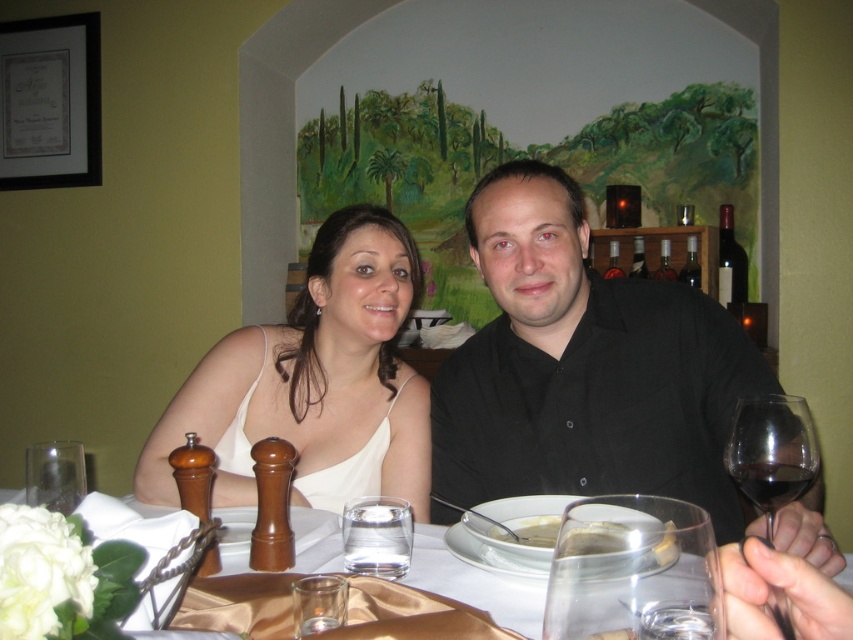
Question: Among these objects, which one is farthest from the camera?

Choices:
 (A) translucent glass water at center
 (B) white creamy soup at center
 (C) transparent glass wine glass at lower right
 (D) transparent glass wine glass at right

Answer: (B)

Question: Does white satin dress at center have a lesser width compared to dark red glass at right?

Choices:
 (A) no
 (B) yes

Answer: (A)

Question: Can you confirm if transparent glass wine glass at lower right is bigger than dark glass bottle at upper right?

Choices:
 (A) no
 (B) yes

Answer: (A)

Question: Based on their relative distances, which object is nearer to the transparent glass wine glass at right?

Choices:
 (A) transparent glass wine glass at lower right
 (B) translucent glass water at center

Answer: (A)

Question: Which point appears farthest from the camera in this image?

Choices:
 (A) (x=741, y=483)
 (B) (x=605, y=522)

Answer: (A)

Question: Is black matte shirt at center smaller than transparent glass wine glass at right?

Choices:
 (A) yes
 (B) no

Answer: (B)